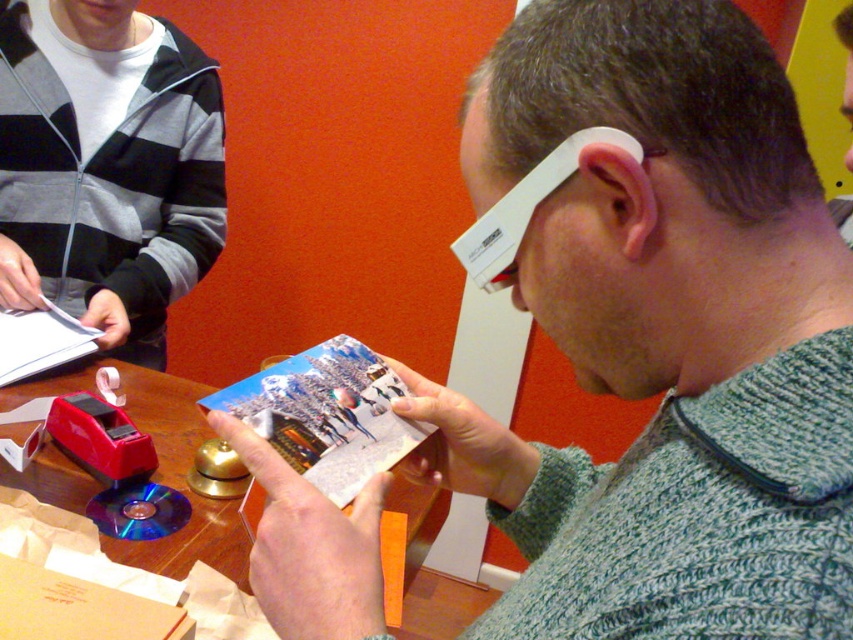
From the picture: You are organizing a charity event and need to decide whether to place the green knitted sweater at center and the printed paper magazine at center on a shelf. The shelf has a width of 15 inches. The sweater takes up 10 inches, and the magazine takes up 3 inches. Can both items fit on the shelf without overlapping?

The green knitted sweater at center is larger in size than the printed paper magazine at center. Since the sweater takes up 10 inches and the magazine takes up 3 inches, together they require 13 inches of space. The shelf is 15 inches wide, so both items can fit without overlapping.

You are standing in the room and need to locate the striped cotton hoodie at upper left. According to the coordinates given, where exactly is it placed?

The striped cotton hoodie at upper left is placed at point 0.261 on the x axis and 0.127 on the y axis.